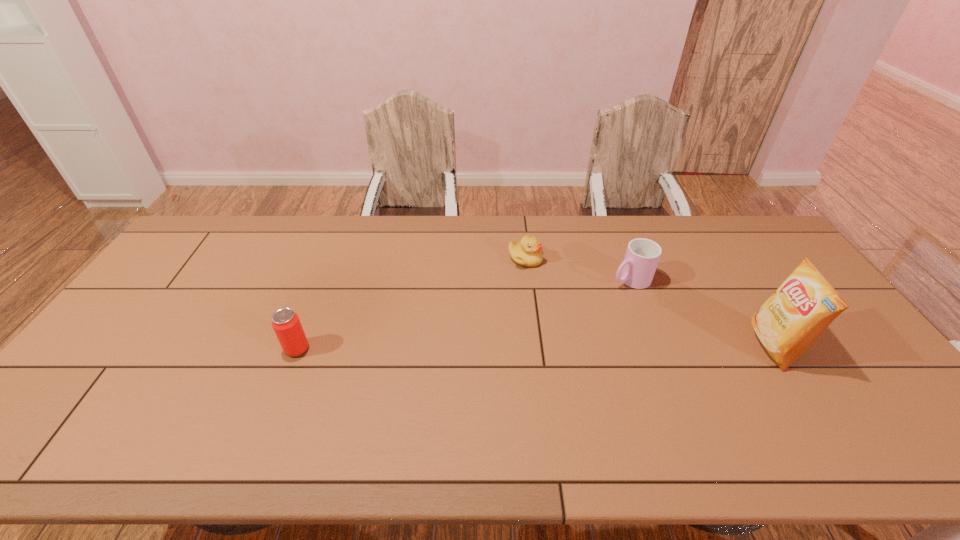
Locate an element on the screen. The width and height of the screenshot is (960, 540). free spot located 0.120m on the front-facing side of the duckling is located at coordinates (553, 292).

The image size is (960, 540). I want to click on vacant point located on the front-facing side of the duckling, so click(x=553, y=292).

The width and height of the screenshot is (960, 540). Identify the location of vacant area situated on the front-facing side of the duckling. (575, 319).

The image size is (960, 540). What are the coordinates of `vacant space situated 0.270m with the handle on the side of the cup` in the screenshot? It's located at (545, 318).

I want to click on free space located with the handle on the side of the cup, so click(602, 291).

At what (x,y) coordinates should I click in order to perform the action: click on vacant space located 0.190m with the handle on the side of the cup. Please return your answer as a coordinate pair (x, y). The image size is (960, 540). Looking at the image, I should click on (566, 308).

The height and width of the screenshot is (540, 960). Find the location of `object present at the far edge`. object present at the far edge is located at coordinates (528, 252).

In the image, there is a desktop. In order to click on free space at the far edge in this screenshot , I will do `click(308, 233)`.

This screenshot has width=960, height=540. Identify the location of free spot at the near edge of the desktop. (385, 389).

In the image, there is a desktop. Identify the location of vacant region at the far right corner. (733, 244).